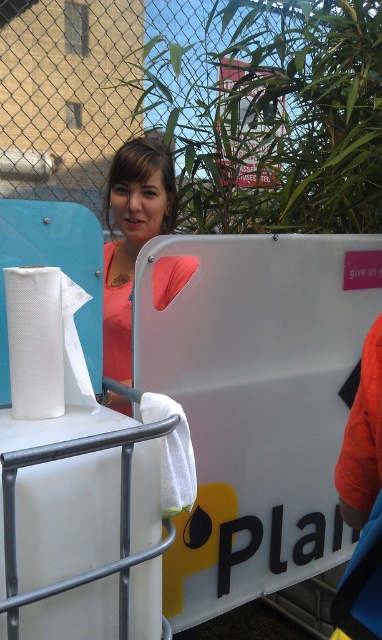
You are at an outdoor event and need to locate the white paper towel at left and the pink matte shirt at center. From your vantage point, which object is closer to you?

The pink matte shirt at center is closer to you because the white paper towel at left is behind it.

Looking at this image, you are organizing a small outdoor event and need to ensure that the pink matte shirt at center and the white paper towel at left are visible to attendees. Given their sizes, which item will require more space to display properly?

The pink matte shirt at center is bigger than the white paper towel at left, so it will require more space to display properly.

You are at an outdoor event and need to use the portable toilet. You see a pink matte shirt at center and a white paper towel at left. Which item is positioned higher up?

The pink matte shirt at center is located above the white paper towel at left, so it is positioned higher up.